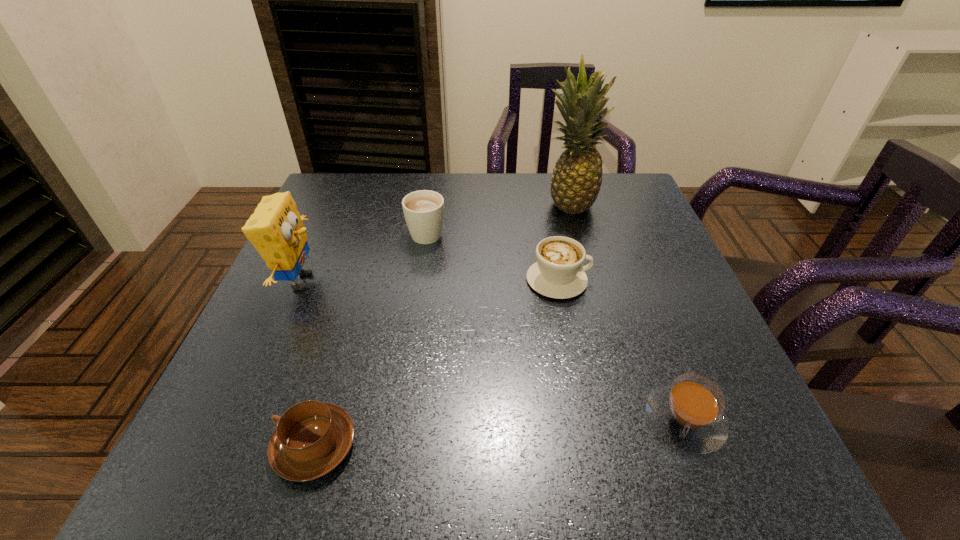
Where is `the tallest object`? The image size is (960, 540). the tallest object is located at coordinates (577, 177).

Identify the location of the leftmost object. (275, 229).

This screenshot has width=960, height=540. In order to click on the second tallest object in this screenshot , I will do `click(275, 229)`.

What are the coordinates of `the second cappuccino from left to right` in the screenshot? It's located at (423, 210).

Identify the location of the tallest cappuccino. The width and height of the screenshot is (960, 540). (423, 210).

Find the location of `the third shortest object`. the third shortest object is located at coordinates (558, 273).

At what (x,y) coordinates should I click in order to perform the action: click on the third cappuccino from left to right. Please return your answer as a coordinate pair (x, y). Looking at the image, I should click on (558, 273).

The image size is (960, 540). Find the location of `the rightmost cappuccino`. the rightmost cappuccino is located at coordinates (688, 413).

You are a GUI agent. You are given a task and a screenshot of the screen. Output one action in this format:
    pyautogui.click(x=<x>, y=<y>)
    Task: Click on the fifth object from right to left
    Image resolution: width=960 pixels, height=540 pixels.
    Given the screenshot: What is the action you would take?
    pyautogui.click(x=312, y=438)

At what (x,y) coordinates should I click in order to perform the action: click on vacant space situated on the front of the tallest object. Please return your answer as a coordinate pair (x, y). Looking at the image, I should click on (585, 267).